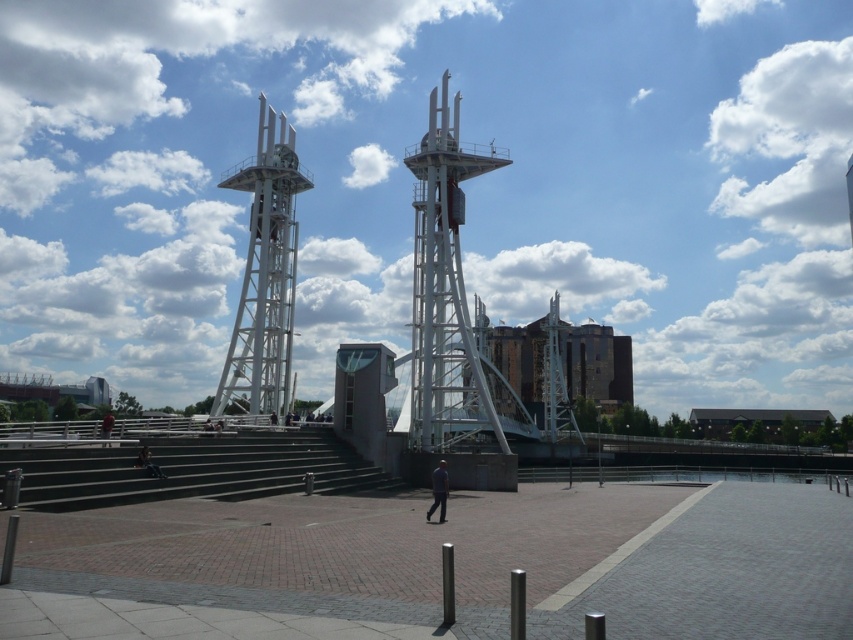
You are planning to take a photo of the dark gray concrete stairs at center and the white metallic tower at upper left. Which object should you focus on first if you want to include both in your frame without zooming in?

You should focus on the white metallic tower at upper left first because it is larger in size compared to the dark gray concrete stairs at center, allowing it to fit better in the frame without zooming.

You are standing in the urban landscape and want to take a photo that includes both the white metallic tower at center and the white metallic tower at upper left. Which tower should you position closer to the left side of your camera frame to include both in the photo?

To include both the white metallic tower at center and the white metallic tower at upper left in the photo, you should position the white metallic tower at upper left closer to the left side of your camera frame since it is on the left side of the white metallic tower at center.